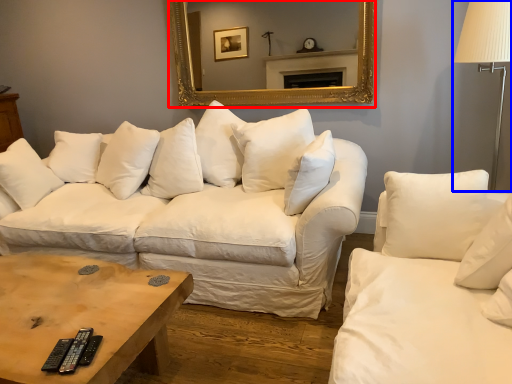
Question: Which object appears farthest to the camera in this image, mirror (highlighted by a red box) or table lamp (highlighted by a blue box)?

Choices:
 (A) mirror
 (B) table lamp

Answer: (A)